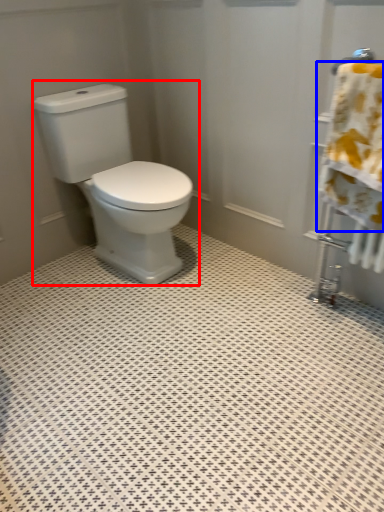
Question: Which object is further to the camera taking this photo, toilet (highlighted by a red box) or bath towel (highlighted by a blue box)?

Choices:
 (A) toilet
 (B) bath towel

Answer: (A)